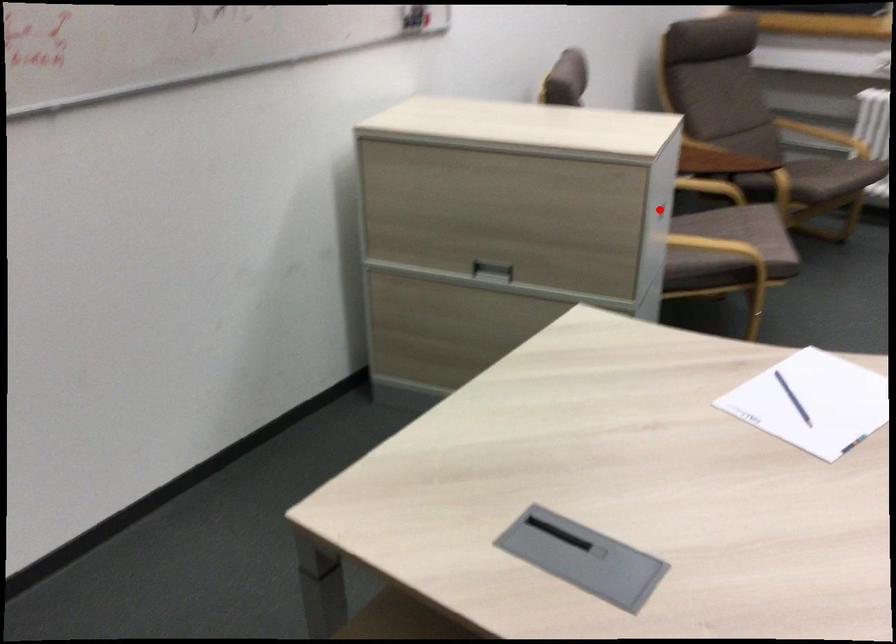
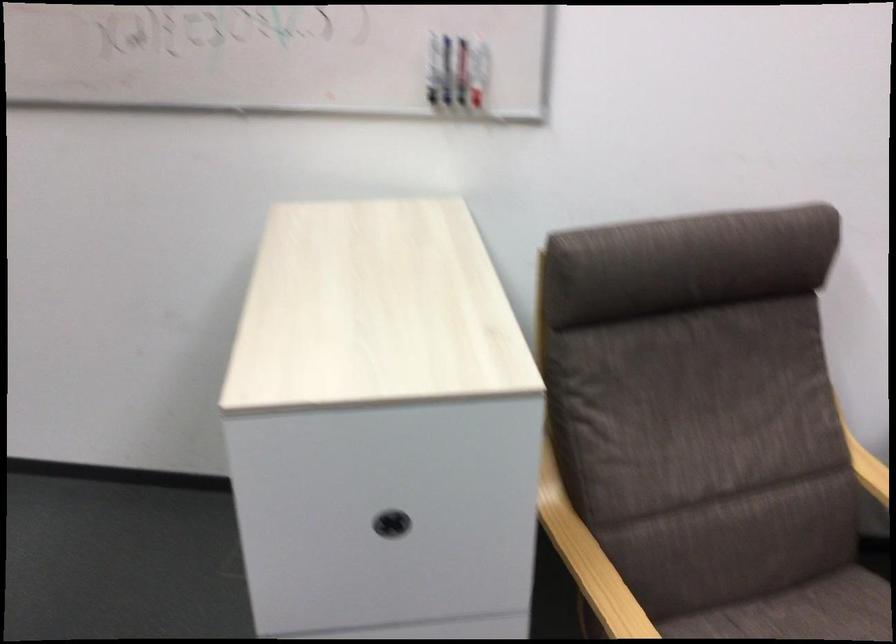
In the second image, find the point that corresponds to the highlighted location in the first image.

(391, 524)